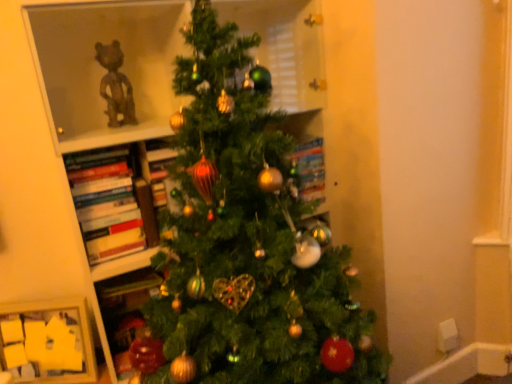
The image size is (512, 384). What are the coordinates of `wooden picture frame at lower left` in the screenshot? It's located at (47, 342).

Is hardcover books at left completely or partially inside green matte christmas tree at center?

Yes.

Is green matte christmas tree at center aimed at hardcover books at left?

Yes, green matte christmas tree at center is turned towards hardcover books at left.

Does green matte christmas tree at center have a smaller size compared to hardcover books at left?

No, green matte christmas tree at center is not smaller than hardcover books at left.

Find the location of a particular element. book behind the green matte christmas tree at center is located at coordinates (112, 201).

Could you tell me if green matte christmas tree at center is turned towards wooden picture frame at lower left?

No, green matte christmas tree at center is not facing towards wooden picture frame at lower left.

Find the location of a particular element. christmas tree on the right of wooden picture frame at lower left is located at coordinates (247, 242).

Is green matte christmas tree at center to the left of wooden picture frame at lower left from the viewer's perspective?

Incorrect, green matte christmas tree at center is not on the left side of wooden picture frame at lower left.

Are green matte christmas tree at center and wooden picture frame at lower left making contact?

No, green matte christmas tree at center is not in contact with wooden picture frame at lower left.

Can you confirm if wooden picture frame at lower left is shorter than hardcover books at left?

Correct, wooden picture frame at lower left is not as tall as hardcover books at left.

Is wooden picture frame at lower left not near hardcover books at left?

No, wooden picture frame at lower left is not far away from hardcover books at left.

Locate an element on the screen. This screenshot has height=384, width=512. book above the wooden picture frame at lower left (from the image's perspective) is located at coordinates coord(112,201).

Considering the relative sizes of wooden picture frame at lower left and hardcover books at left in the image provided, is wooden picture frame at lower left thinner than hardcover books at left?

Yes, wooden picture frame at lower left is thinner than hardcover books at left.

Are wooden picture frame at lower left and green matte christmas tree at center located far from each other?

Actually, wooden picture frame at lower left and green matte christmas tree at center are a little close together.

From the image's perspective, which one is positioned lower, wooden picture frame at lower left or green matte christmas tree at center?

From the image's view, wooden picture frame at lower left is below.

Is wooden picture frame at lower left oriented away from green matte christmas tree at center?

No, green matte christmas tree at center is not at the back of wooden picture frame at lower left.

Is point (15, 316) closer to viewer compared to point (373, 373)?

No.

Would you say hardcover books at left is outside green matte christmas tree at center?

That's incorrect, hardcover books at left is not completely outside green matte christmas tree at center.

Considering the relative sizes of hardcover books at left and green matte christmas tree at center in the image provided, is hardcover books at left wider than green matte christmas tree at center?

No.

Would you say hardcover books at left is a long distance from green matte christmas tree at center?

hardcover books at left is near green matte christmas tree at center, not far away.

In the scene shown: Is green matte christmas tree at center at the back of hardcover books at left?

Yes, hardcover books at left's orientation is away from green matte christmas tree at center.

Do you think hardcover books at left is within wooden picture frame at lower left, or outside of it?

The correct answer is: outside.

Which of these two, hardcover books at left or wooden picture frame at lower left, stands taller?

Standing taller between the two is hardcover books at left.

Does hardcover books at left have a smaller size compared to wooden picture frame at lower left?

No, hardcover books at left is not smaller than wooden picture frame at lower left.

From a real-world perspective, which is physically below, hardcover books at left or wooden picture frame at lower left?

From a 3D spatial view, wooden picture frame at lower left is below.

This screenshot has width=512, height=384. In order to click on christmas tree that appears in front of the hardcover books at left in this screenshot , I will do `click(247, 242)`.

Identify the location of christmas tree located on the right of wooden picture frame at lower left. (247, 242).

From the image, which object appears to be nearer to hardcover books at left, green matte christmas tree at center or wooden picture frame at lower left?

Based on the image, wooden picture frame at lower left appears to be nearer to hardcover books at left.

Looking at the image, which one is located closer to wooden picture frame at lower left, hardcover books at left or green matte christmas tree at center?

hardcover books at left is closer to wooden picture frame at lower left.

Which object lies further to the anchor point wooden picture frame at lower left, green matte christmas tree at center or hardcover books at left?

green matte christmas tree at center is further to wooden picture frame at lower left.

Looking at the image, which one is located closer to green matte christmas tree at center, wooden picture frame at lower left or hardcover books at left?

Among the two, hardcover books at left is located nearer to green matte christmas tree at center.

Which object lies further to the anchor point green matte christmas tree at center, hardcover books at left or wooden picture frame at lower left?

The object further to green matte christmas tree at center is wooden picture frame at lower left.

Consider the image. Estimate the real-world distances between objects in this image. Which object is closer to hardcover books at left, wooden picture frame at lower left or green matte christmas tree at center?

wooden picture frame at lower left is closer to hardcover books at left.

Locate an element on the screen. The height and width of the screenshot is (384, 512). book located between wooden picture frame at lower left and green matte christmas tree at center in the left-right direction is located at coordinates (112, 201).